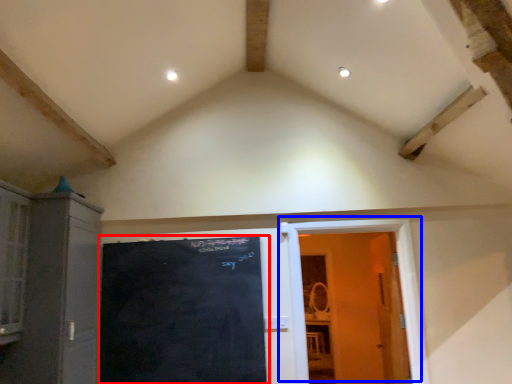
Question: Among these objects, which one is farthest to the camera, bulletin board (highlighted by a red box) or door (highlighted by a blue box)?

Choices:
 (A) bulletin board
 (B) door

Answer: (B)